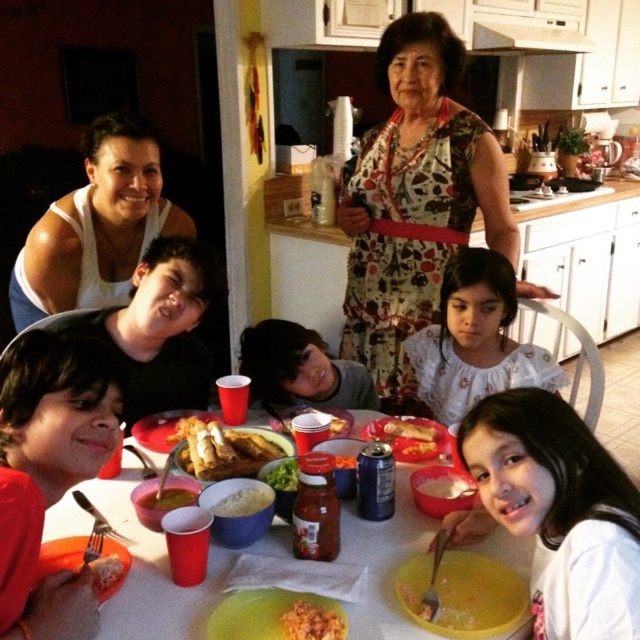
Between white tank top at upper left and golden crispy tacos at center, which one is positioned lower?

golden crispy tacos at center is below.

Which is behind, point (186, 228) or point (234, 467)?

Positioned behind is point (186, 228).

Identify the location of white tank top at upper left. The height and width of the screenshot is (640, 640). (97, 227).

Is crumbly yellow rice at lower center behind green leafy vegetables at center?

No, crumbly yellow rice at lower center is in front of green leafy vegetables at center.

This screenshot has width=640, height=640. Find the location of `crumbly yellow rice at lower center`. crumbly yellow rice at lower center is located at coordinates (312, 621).

Does point (337, 630) come in front of point (268, 474)?

Yes, point (337, 630) is in front of point (268, 474).

Locate an element on the screen. The width and height of the screenshot is (640, 640). crumbly yellow rice at lower center is located at coordinates (312, 621).

Is the position of white matte bowl at center less distant than that of green leafy vegetables at center?

Yes, white matte bowl at center is closer to the viewer.

Where is `white matte bowl at center`? The height and width of the screenshot is (640, 640). white matte bowl at center is located at coordinates (244, 500).

Locate an element on the screen. This screenshot has width=640, height=640. white matte bowl at center is located at coordinates pos(244,500).